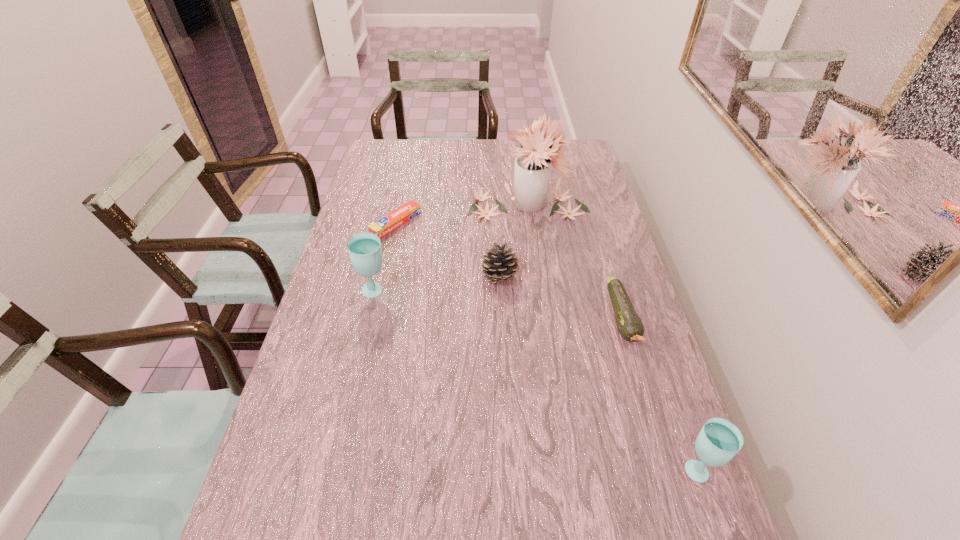
Locate an element on the screen. Image resolution: width=960 pixels, height=540 pixels. vacant space at the near edge of the desktop is located at coordinates (480, 522).

Identify the location of free spot at the left edge of the desktop. (390, 209).

In the image, there is a desktop. Identify the location of free space at the right edge. (626, 281).

Locate an element on the screen. The height and width of the screenshot is (540, 960). free spot between the zucchini and the pinecone is located at coordinates (561, 296).

Where is `unoccupied position between the left glass and the right glass`? This screenshot has width=960, height=540. unoccupied position between the left glass and the right glass is located at coordinates (536, 380).

At what (x,y) coordinates should I click in order to perform the action: click on free space between the second tallest object and the zucchini. Please return your answer as a coordinate pair (x, y). The height and width of the screenshot is (540, 960). Looking at the image, I should click on (498, 305).

I want to click on vacant area that lies between the fourth shortest object and the toothpaste, so click(x=546, y=346).

I want to click on free space between the second shortest object and the second tallest object, so click(498, 305).

The width and height of the screenshot is (960, 540). Find the location of `empty location between the tallest object and the farther glass`. empty location between the tallest object and the farther glass is located at coordinates (451, 248).

This screenshot has height=540, width=960. Find the location of `vacant area between the left glass and the tallest object`. vacant area between the left glass and the tallest object is located at coordinates (451, 248).